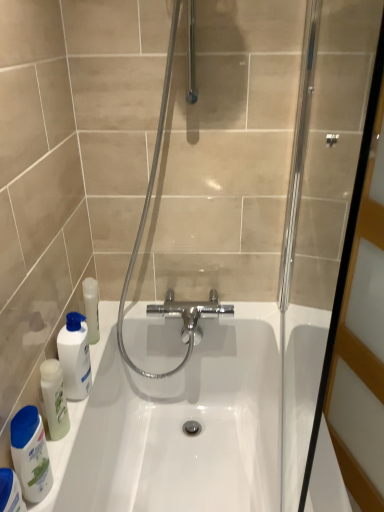
Question: Is white glossy bottle at lower left, positioned as the 2th cleaning product in front-to-back order, in contact with clear glass screen door at right?

Choices:
 (A) no
 (B) yes

Answer: (A)

Question: Does white glossy bottle at lower left, positioned as the 2th cleaning product in front-to-back order, have a greater height compared to clear glass screen door at right?

Choices:
 (A) yes
 (B) no

Answer: (B)

Question: From the image's perspective, is white glossy bottle at lower left, which is the second cleaning product in back-to-front order, beneath clear glass screen door at right?

Choices:
 (A) no
 (B) yes

Answer: (B)

Question: Is white glossy bottle at lower left, positioned as the 2th cleaning product in front-to-back order, located outside clear glass screen door at right?

Choices:
 (A) no
 (B) yes

Answer: (B)

Question: Does white glossy bottle at lower left, positioned as the 2th cleaning product in front-to-back order, lie in front of clear glass screen door at right?

Choices:
 (A) yes
 (B) no

Answer: (B)

Question: Can you confirm if white glossy bottle at lower left, which is the second cleaning product in back-to-front order, is shorter than clear glass screen door at right?

Choices:
 (A) no
 (B) yes

Answer: (B)

Question: Is clear glass screen door at right facing away from white glossy mouthwash at left?

Choices:
 (A) yes
 (B) no

Answer: (A)

Question: Can you confirm if clear glass screen door at right is shorter than white glossy mouthwash at left?

Choices:
 (A) yes
 (B) no

Answer: (B)

Question: Is clear glass screen door at right closer to camera compared to white glossy mouthwash at left?

Choices:
 (A) yes
 (B) no

Answer: (A)

Question: Is clear glass screen door at right wider than white glossy mouthwash at left?

Choices:
 (A) yes
 (B) no

Answer: (B)

Question: Does clear glass screen door at right appear on the right side of white glossy mouthwash at left?

Choices:
 (A) no
 (B) yes

Answer: (B)

Question: From a real-world perspective, is clear glass screen door at right over white glossy mouthwash at left?

Choices:
 (A) no
 (B) yes

Answer: (B)

Question: Can you see clear glass screen door at right touching translucent plastic bottle at lower left, the 3th cleaning product positioned from the back?

Choices:
 (A) yes
 (B) no

Answer: (B)